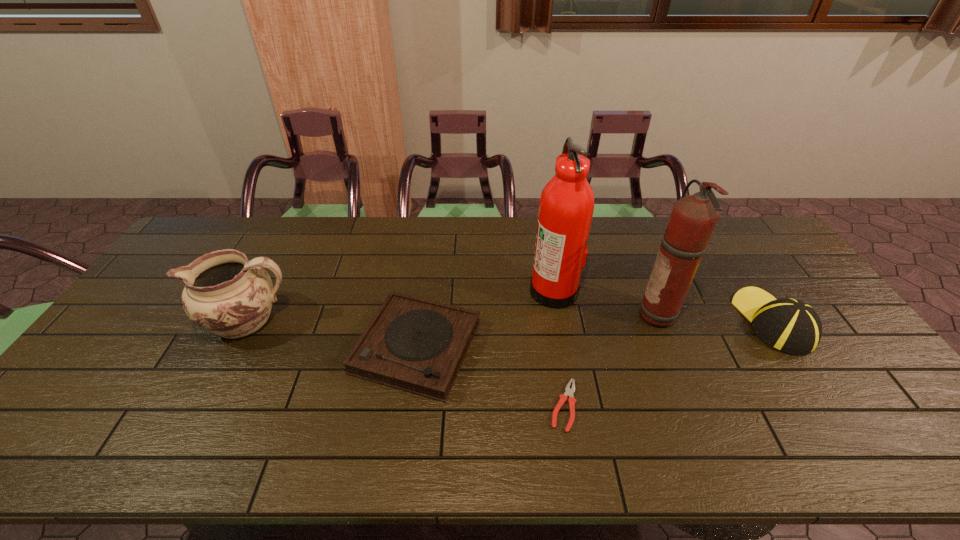
Find the location of a particular element. vacant space located 0.340m with the brim of the fourth tallest object facing forward is located at coordinates (711, 227).

I want to click on free space located 0.320m on the back of the phonograph record, so click(x=431, y=238).

Where is `free spot located on the right of the pliers`? The height and width of the screenshot is (540, 960). free spot located on the right of the pliers is located at coordinates (657, 406).

This screenshot has height=540, width=960. Identify the location of object that is at the near edge. (568, 392).

Where is `object that is positioned at the right edge`? object that is positioned at the right edge is located at coordinates (789, 325).

In the image, there is a desktop. At what (x,y) coordinates should I click in order to perform the action: click on vacant space at the far edge. Please return your answer as a coordinate pair (x, y). This screenshot has height=540, width=960. Looking at the image, I should click on (590, 255).

You are a GUI agent. You are given a task and a screenshot of the screen. Output one action in this format:
    pyautogui.click(x=<x>, y=<y>)
    Task: Click on the vacant space at the near edge
    
    Given the screenshot: What is the action you would take?
    pyautogui.click(x=516, y=440)

This screenshot has height=540, width=960. In the image, there is a desktop. What are the coordinates of `free space at the right edge` in the screenshot? It's located at (861, 388).

This screenshot has width=960, height=540. In order to click on free space at the far right corner of the desktop in this screenshot , I will do `click(759, 238)`.

Where is `free space at the near right corner`? This screenshot has width=960, height=540. free space at the near right corner is located at coordinates (857, 431).